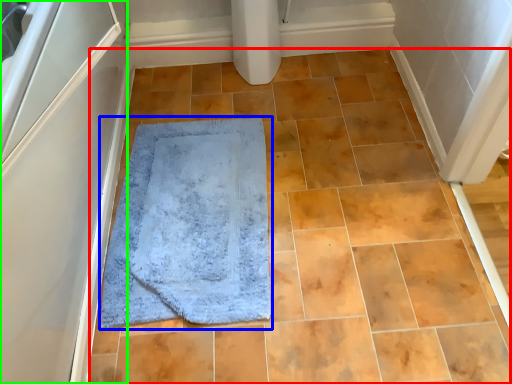
Question: Based on their relative distances, which object is nearer to ceramic tile (highlighted by a red box)? Choose from bath mat (highlighted by a blue box) and screen door (highlighted by a green box).

Choices:
 (A) bath mat
 (B) screen door

Answer: (A)